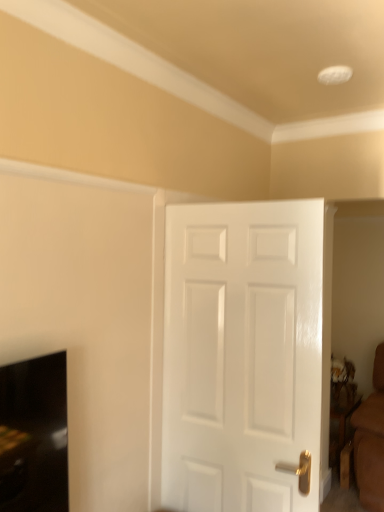
What do you see at coordinates (242, 355) in the screenshot? This screenshot has width=384, height=512. I see `white glossy door at center` at bounding box center [242, 355].

Locate an element on the screen. white glossy door at center is located at coordinates (242, 355).

Image resolution: width=384 pixels, height=512 pixels. What are the coordinates of `white glossy door at center` in the screenshot? It's located at (242, 355).